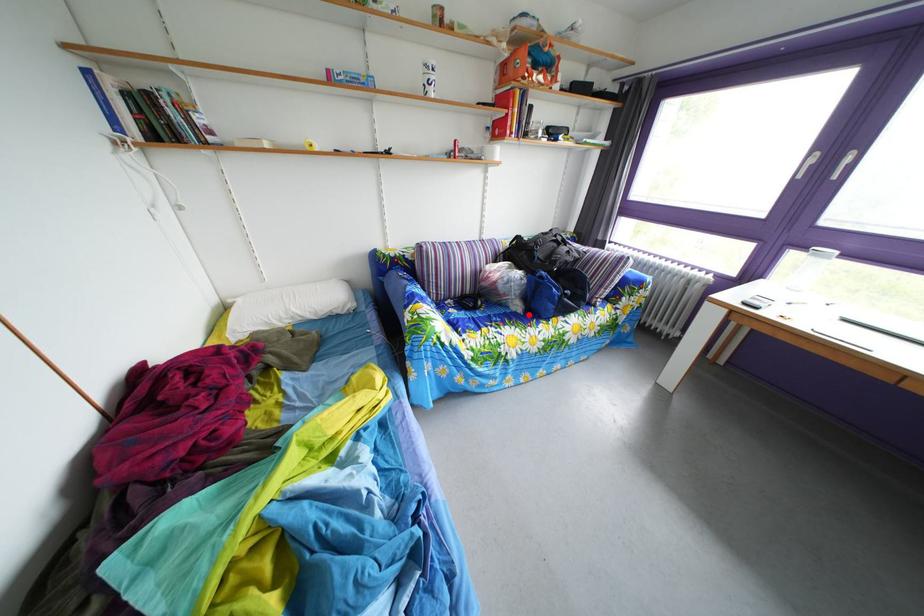
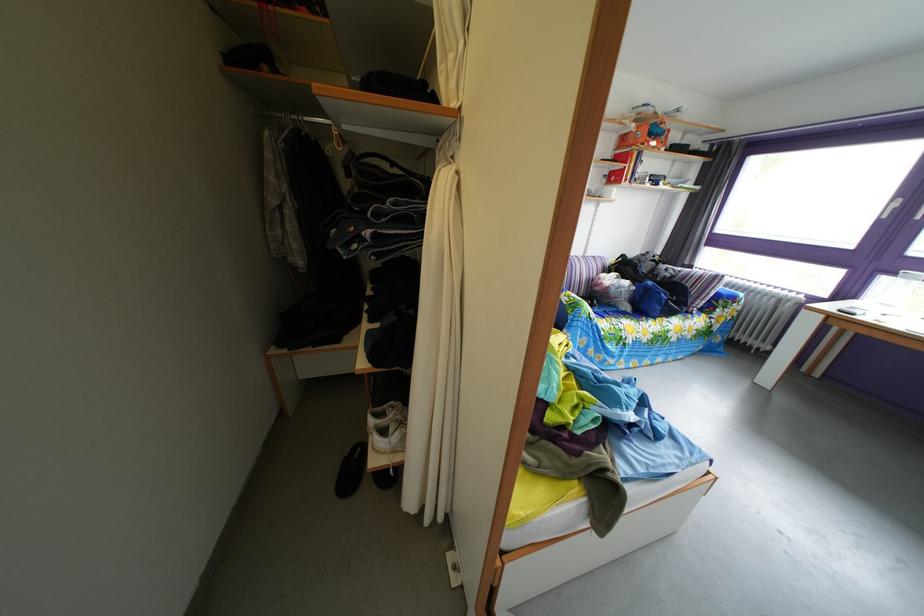
Find the pixel in the second image that matches the highlighted location in the first image.

(638, 315)